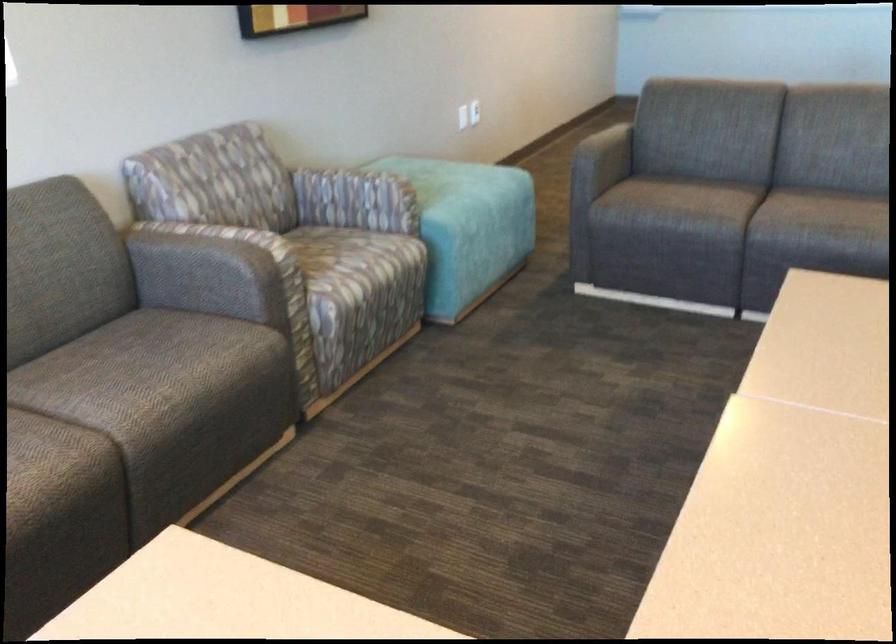
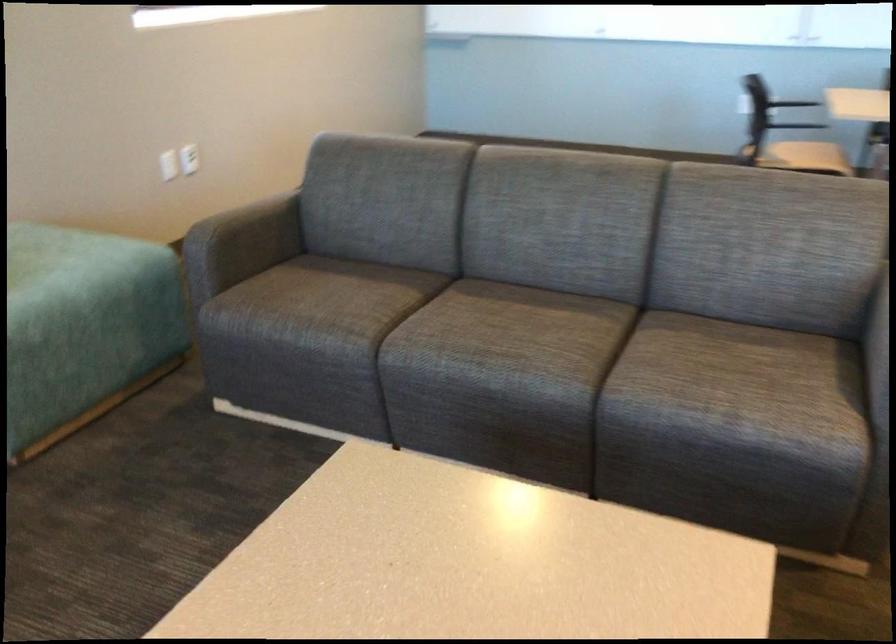
The point at (424, 169) is marked in the first image. Where is the corresponding point in the second image?

(56, 251)